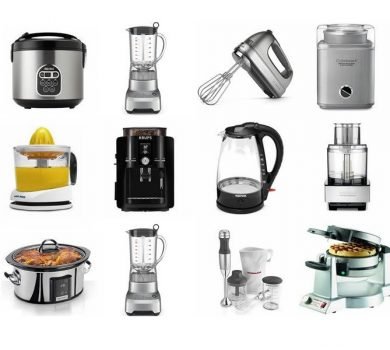
Locate an element on the screen. Image resolution: width=390 pixels, height=350 pixels. metallic green waffle maker is located at coordinates (351, 275).